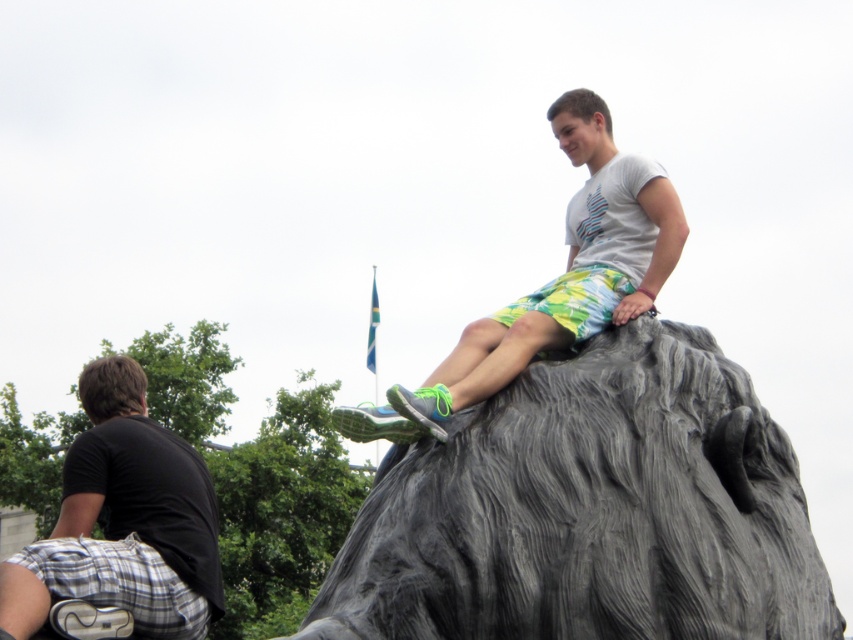
You are standing in front of the sculpture and want to place a small decorative item exactly at the point marked by coordinates (590, 509). Based on the description, where on the sculpture should you place it?

The point marked by coordinates (590, 509) corresponds to the gray textured rock at upper center of the sculpture, so you should place the decorative item there.

You are standing in front of the sculpture and want to take a photo of both the black cotton shirt at lower left and the light gray stone statue at upper center. Which object should you focus on first to ensure both are in frame?

You should focus on the light gray stone statue at upper center first because it is positioned higher than the black cotton shirt at lower left, so adjusting the camera angle to include the higher statue will naturally include the lower shirt in the frame.